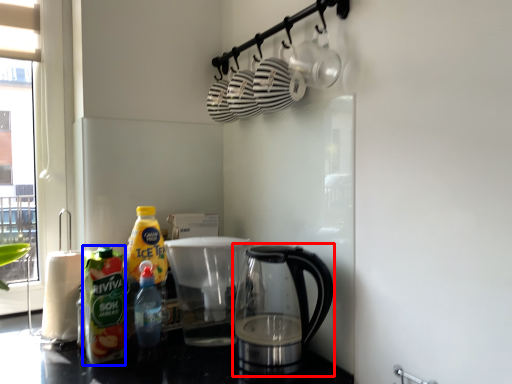
Question: Which of the following is the farthest to the observer, kettle (highlighted by a red box) or bottle (highlighted by a blue box)?

Choices:
 (A) kettle
 (B) bottle

Answer: (B)